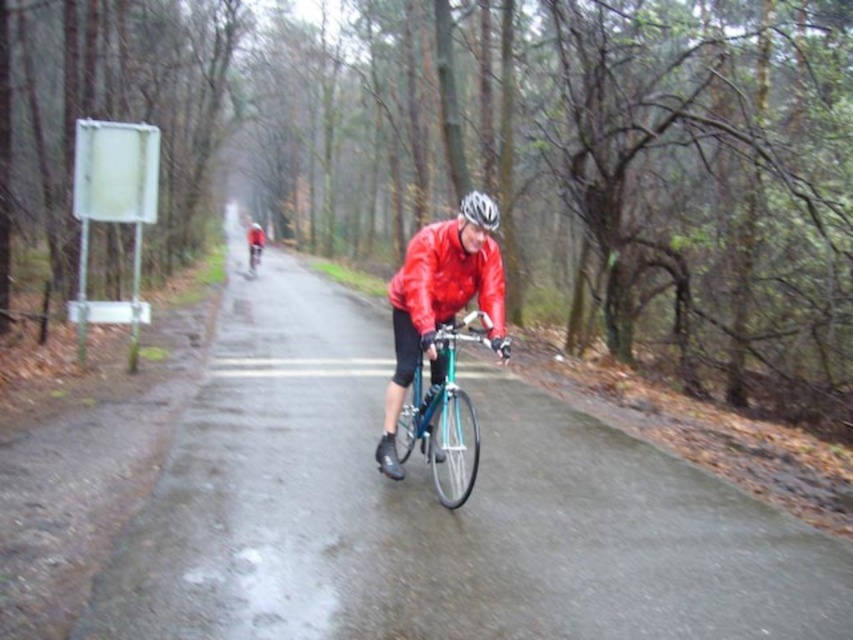
Question: Estimate the real-world distances between objects in this image. Which object is closer to the teal metallic bicycle at center?

Choices:
 (A) red matte jacket at center
 (B) shiny metallic bicycle at center

Answer: (B)

Question: Which object appears closest to the camera in this image?

Choices:
 (A) red matte jacket at center
 (B) shiny metallic bicycle at center
 (C) white matte helmet at center

Answer: (C)

Question: Based on their relative distances, which object is farther from the white matte helmet at center?

Choices:
 (A) teal metallic bicycle at center
 (B) matte red jacket at center

Answer: (B)

Question: Where is matte red jacket at center located in relation to white matte helmet at center in the image?

Choices:
 (A) right
 (B) left

Answer: (B)

Question: Does teal metallic bicycle at center appear under shiny metallic bicycle at center?

Choices:
 (A) yes
 (B) no

Answer: (A)

Question: Where is matte red jacket at center located in relation to white matte helmet at center in the image?

Choices:
 (A) left
 (B) right

Answer: (A)